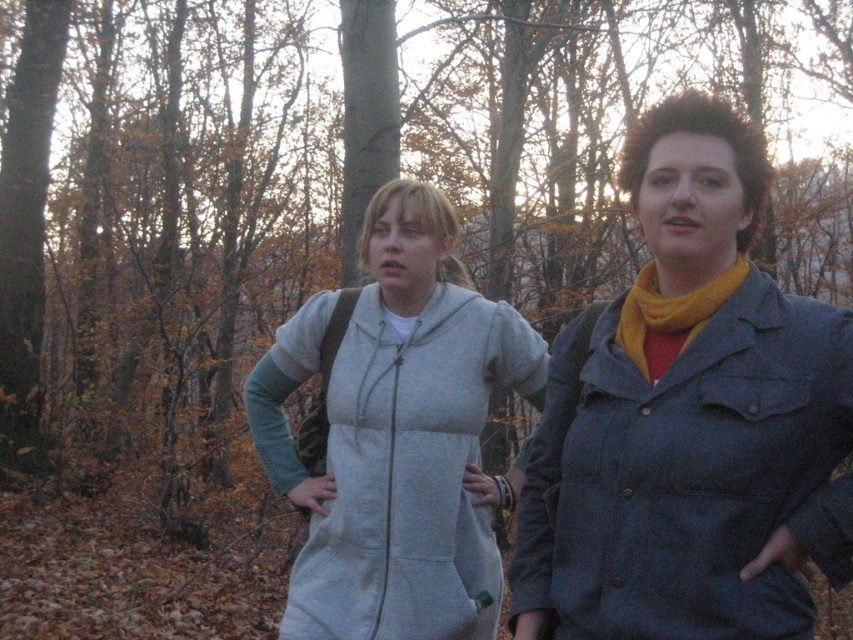
Question: Can you confirm if denim jacket at right is thinner than yellow fuzzy scarf at right?

Choices:
 (A) yes
 (B) no

Answer: (B)

Question: Is denim jacket at right bigger than gray fleece hoodie at center?

Choices:
 (A) yes
 (B) no

Answer: (B)

Question: Does gray fleece hoodie at center appear on the right side of yellow fuzzy scarf at right?

Choices:
 (A) no
 (B) yes

Answer: (A)

Question: Which of the following is the farthest from the observer?

Choices:
 (A) yellow fuzzy scarf at right
 (B) denim jacket at right
 (C) gray fleece hoodie at center

Answer: (C)

Question: Which object is positioned closest to the gray fleece hoodie at center?

Choices:
 (A) denim jacket at right
 (B) yellow fuzzy scarf at right

Answer: (A)

Question: Which is nearer to the gray fleece hoodie at center?

Choices:
 (A) yellow fuzzy scarf at right
 (B) denim jacket at right

Answer: (B)